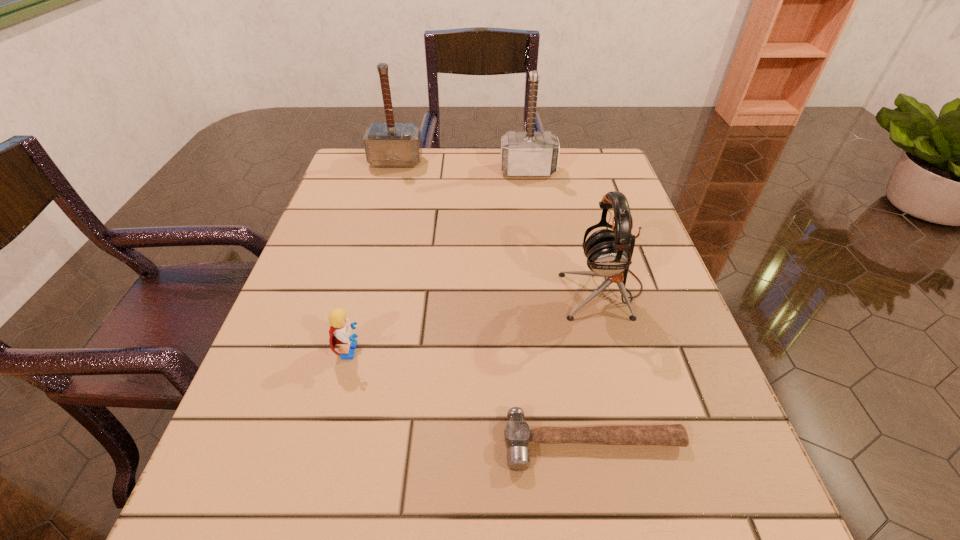
Identify the location of hammer positioned at the left edge. (391, 144).

Image resolution: width=960 pixels, height=540 pixels. I want to click on Lego present at the left edge, so [x=340, y=332].

At what (x,y) coordinates should I click in order to perform the action: click on earphone positioned at the right edge. Please return your answer as a coordinate pair (x, y). The width and height of the screenshot is (960, 540). Looking at the image, I should click on (609, 252).

Image resolution: width=960 pixels, height=540 pixels. I want to click on hammer located in the right edge section of the desktop, so click(517, 433).

Locate an element on the screen. The width and height of the screenshot is (960, 540). object located in the far left corner section of the desktop is located at coordinates (391, 144).

Where is `vacant space at the far edge`? vacant space at the far edge is located at coordinates (399, 192).

Locate an element on the screen. The width and height of the screenshot is (960, 540). vacant space at the near edge is located at coordinates (628, 495).

Find the location of `free location at the left edge of the desktop`. free location at the left edge of the desktop is located at coordinates (288, 325).

Find the location of `free spot at the right edge of the desktop`. free spot at the right edge of the desktop is located at coordinates (633, 272).

Identify the location of vacant space at the far left corner of the desktop. (352, 158).